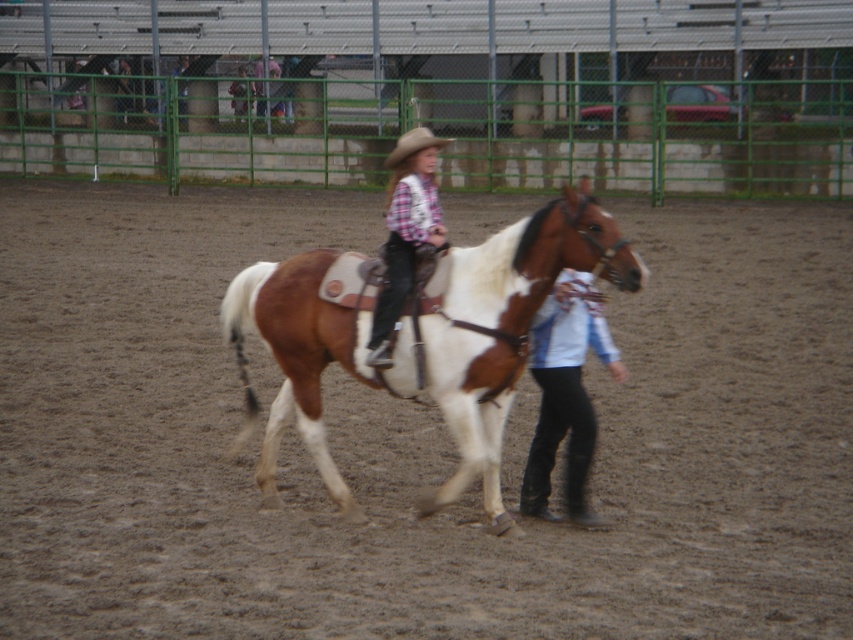
You are a photographer at the rodeo event. You need to capture a photo where both the black leather pants at lower right and the plaid shirt and jeans at center are visible. Which clothing item should you focus on first to ensure both are in frame?

The black leather pants at lower right has a lesser height compared to plaid shirt and jeans at center, so you should focus on the plaid shirt and jeans at center first to ensure both are in frame.

You are a photographer at the rodeo event. You need to capture a photo that includes both the black leather pants at lower right and the matte brown cowboy hat at upper center. Which object should be placed closer to the camera to ensure both are clearly visible in the photo?

The black leather pants at lower right should be placed closer to the camera because it has a larger size compared to the matte brown cowboy hat at upper center, ensuring both objects are clearly visible in the photo.